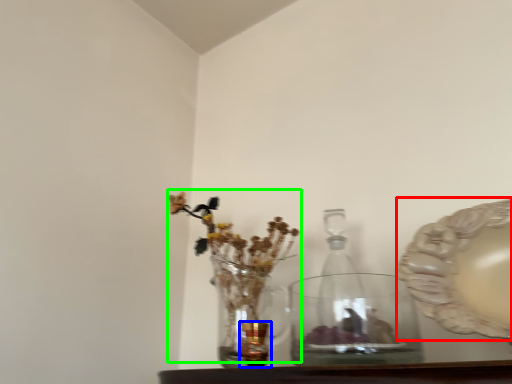
Question: Based on their relative distances, which object is nearer to platter (highlighted by a red box)? Choose from candle holder (highlighted by a blue box) and floral arrangement (highlighted by a green box).

Choices:
 (A) candle holder
 (B) floral arrangement

Answer: (A)